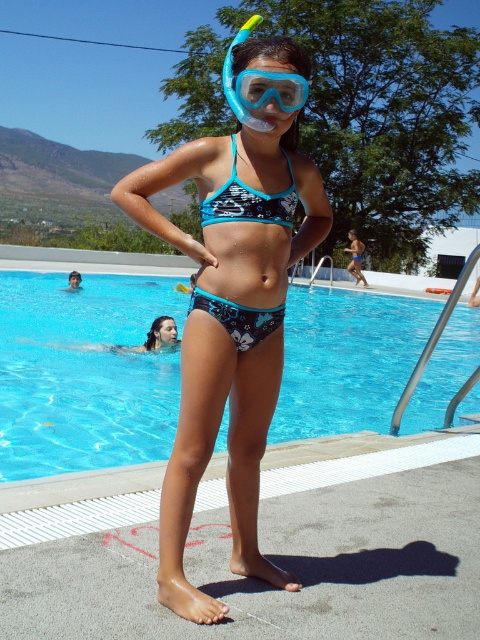
Question: Among these objects, which one is farthest from the camera?

Choices:
 (A) matte blue swimsuit at center
 (B) teal printed bikini top at center
 (C) matte blue bikini at center

Answer: (A)

Question: Among these points, which one is nearest to the camera?

Choices:
 (A) (219, 616)
 (B) (276, 209)

Answer: (A)

Question: Among these objects, which one is nearest to the camera?

Choices:
 (A) matte blue swimsuit at center
 (B) blue printed bikini bottom at center
 (C) matte blue bikini at center
 (D) teal printed bikini top at center

Answer: (C)

Question: From the image, what is the correct spatial relationship of matte blue bikini at center in relation to teal printed bikini top at center?

Choices:
 (A) right
 (B) left

Answer: (B)

Question: Can you confirm if matte blue bikini at center is bigger than transparent plastic goggles at center?

Choices:
 (A) no
 (B) yes

Answer: (B)

Question: Does matte blue bikini at center have a greater width compared to teal printed bikini top at center?

Choices:
 (A) yes
 (B) no

Answer: (A)